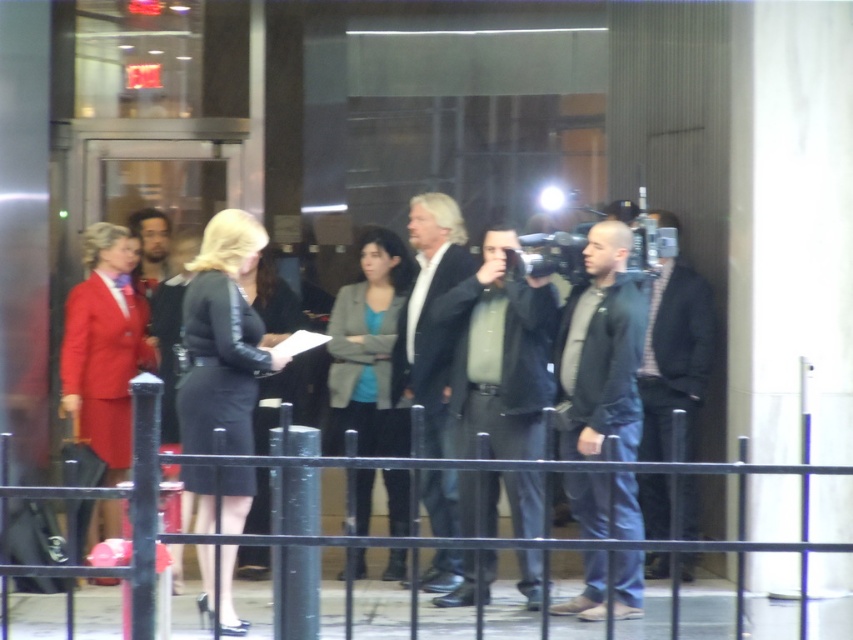
Question: Which point is closer to the camera?

Choices:
 (A) matte black jacket at center
 (B) matte gray blazer at center

Answer: (A)

Question: Among these objects, which one is farthest from the camera?

Choices:
 (A) black metal fence at lower center
 (B) dark gray hoodie at center

Answer: (B)

Question: Observing the image, what is the correct spatial positioning of black metal fence at lower center in reference to dark gray suit at center?

Choices:
 (A) right
 (B) left

Answer: (B)

Question: From the image, what is the correct spatial relationship of black metal fence at lower center in relation to matte red suit at left?

Choices:
 (A) right
 (B) left

Answer: (A)

Question: Does black leather dress at center appear over dark gray suit at center?

Choices:
 (A) no
 (B) yes

Answer: (A)

Question: Which object is closer to the camera taking this photo?

Choices:
 (A) black leather dress at center
 (B) matte red suit at left
 (C) dark gray hoodie at center
 (D) matte black jacket at center

Answer: (A)